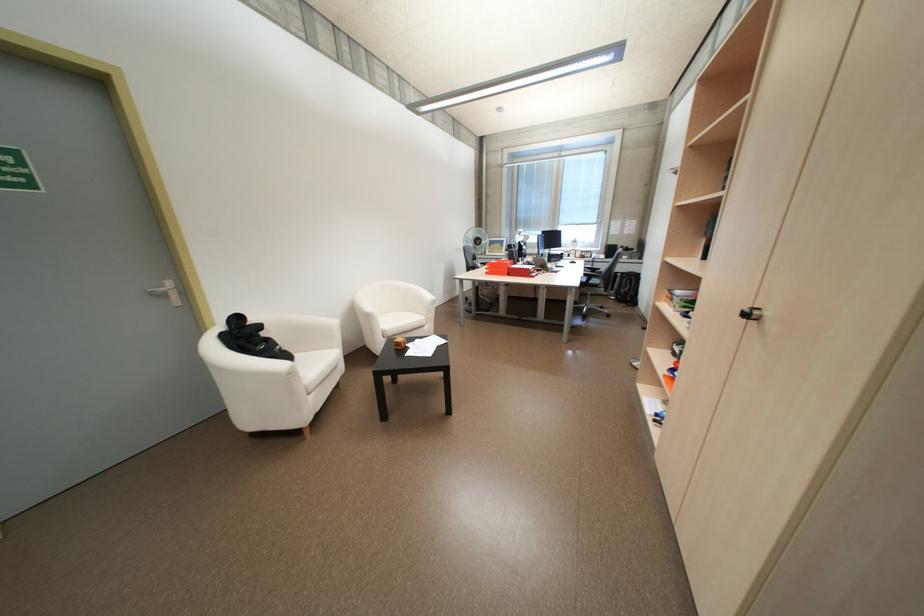
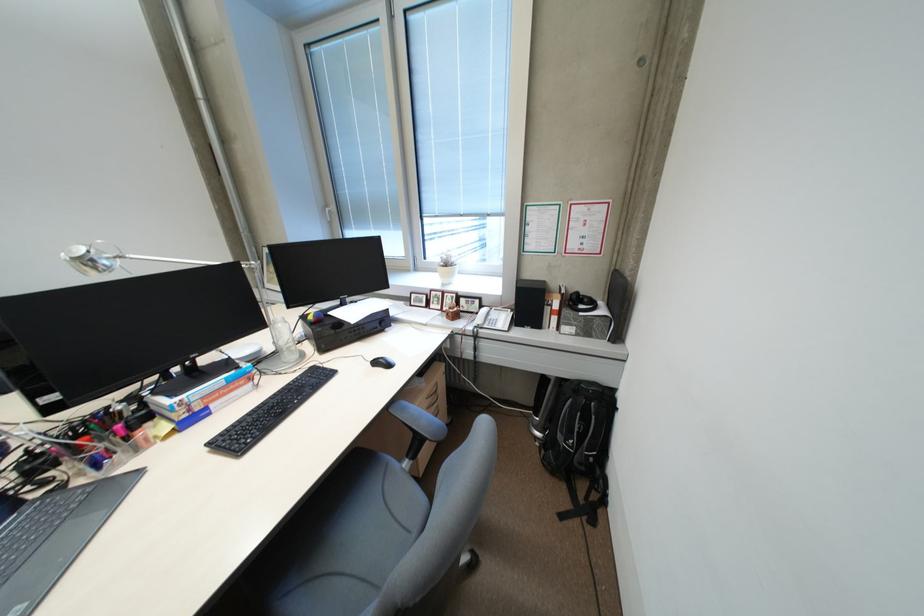
Question: I am providing you with two images of the same scene from different viewpoints. After the viewpoint changes to image2, which objects are now occluded?

Choices:
 (A) silver lamp head
 (B) drawer handle
 (C) black receiver dial
 (D) none of these

Answer: (D)